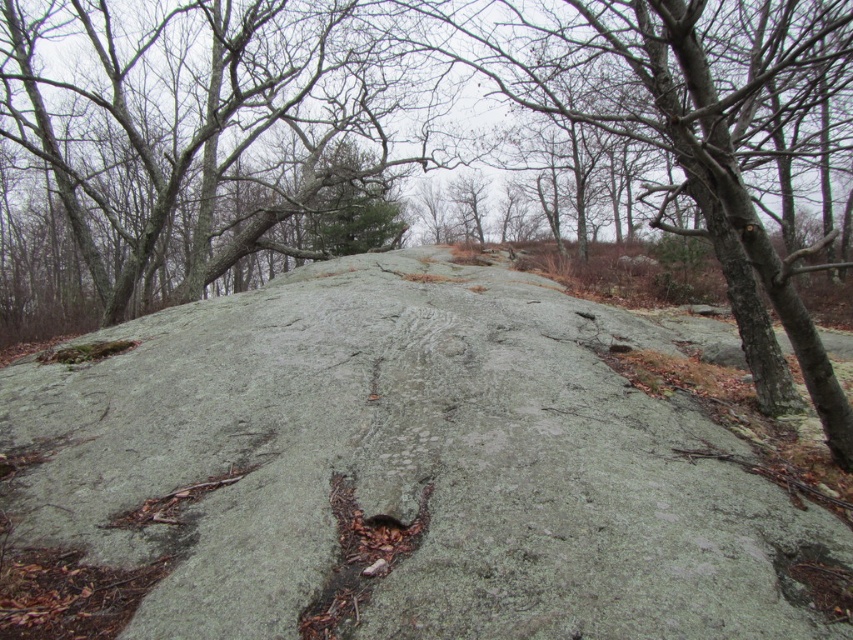
Question: Does gray rough rock at center appear on the left side of green mossy rock at center?

Choices:
 (A) no
 (B) yes

Answer: (A)

Question: Is gray rough rock at center positioned in front of green mossy rock at center?

Choices:
 (A) no
 (B) yes

Answer: (B)

Question: Among these objects, which one is farthest from the camera?

Choices:
 (A) green mossy rock at center
 (B) gray rough rock at center

Answer: (A)

Question: Where is gray rough rock at center located in relation to green mossy rock at center in the image?

Choices:
 (A) below
 (B) above

Answer: (A)

Question: Which of the following is the closest to the observer?

Choices:
 (A) (310, 129)
 (B) (751, 481)

Answer: (B)